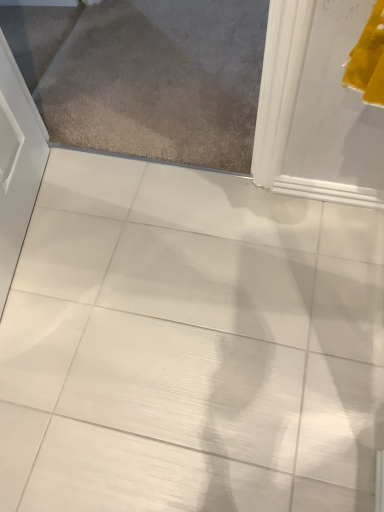
Question: Is white glossy tile at center outside of matte gray carpet at upper left?

Choices:
 (A) yes
 (B) no

Answer: (A)

Question: Considering the relative sizes of white glossy tile at center and matte gray carpet at upper left in the image provided, is white glossy tile at center smaller than matte gray carpet at upper left?

Choices:
 (A) yes
 (B) no

Answer: (B)

Question: Is white glossy tile at center shorter than matte gray carpet at upper left?

Choices:
 (A) no
 (B) yes

Answer: (A)

Question: Does white glossy tile at center have a greater height compared to matte gray carpet at upper left?

Choices:
 (A) yes
 (B) no

Answer: (B)

Question: From a real-world perspective, is white glossy tile at center under matte gray carpet at upper left?

Choices:
 (A) yes
 (B) no

Answer: (A)

Question: Considering the relative sizes of white glossy tile at center and matte gray carpet at upper left in the image provided, is white glossy tile at center wider than matte gray carpet at upper left?

Choices:
 (A) no
 (B) yes

Answer: (A)

Question: Is matte gray carpet at upper left smaller than white glossy tile at center?

Choices:
 (A) yes
 (B) no

Answer: (A)

Question: Considering the relative sizes of matte gray carpet at upper left and white glossy tile at center in the image provided, is matte gray carpet at upper left wider than white glossy tile at center?

Choices:
 (A) yes
 (B) no

Answer: (A)

Question: Does matte gray carpet at upper left contain white glossy tile at center?

Choices:
 (A) yes
 (B) no

Answer: (B)

Question: Does matte gray carpet at upper left have a greater height compared to white glossy tile at center?

Choices:
 (A) no
 (B) yes

Answer: (A)

Question: Can we say matte gray carpet at upper left lies outside white glossy tile at center?

Choices:
 (A) no
 (B) yes

Answer: (B)

Question: Is matte gray carpet at upper left to the right of white glossy tile at center from the viewer's perspective?

Choices:
 (A) yes
 (B) no

Answer: (A)

Question: Does point (29, 453) appear closer or farther from the camera than point (160, 143)?

Choices:
 (A) farther
 (B) closer

Answer: (B)